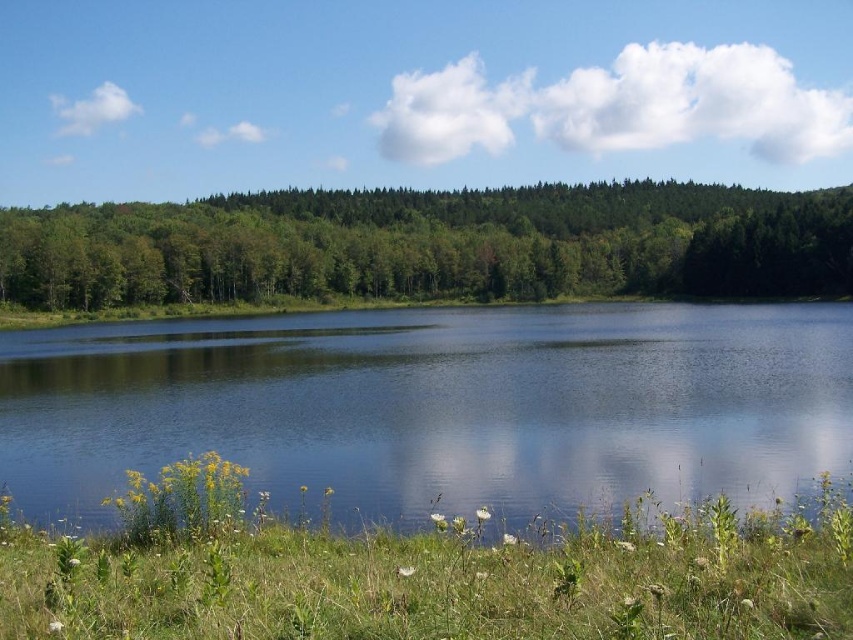
You are standing on the lakeshore and see the transparent water at center and the green leafy forest at upper center. Which object is closer to you?

The transparent water at center is closer to you than the green leafy forest at upper center because it is positioned below it.